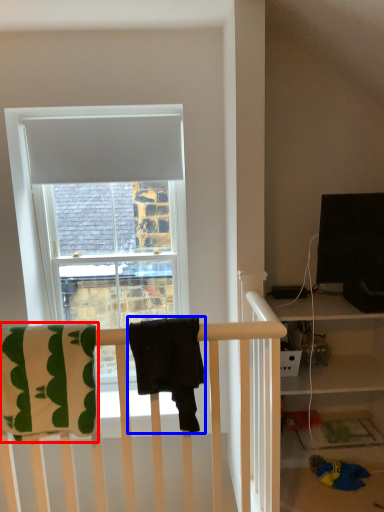
Question: Among these objects, which one is farthest to the camera, beach towel (highlighted by a red box) or beach towel (highlighted by a blue box)?

Choices:
 (A) beach towel
 (B) beach towel

Answer: (A)